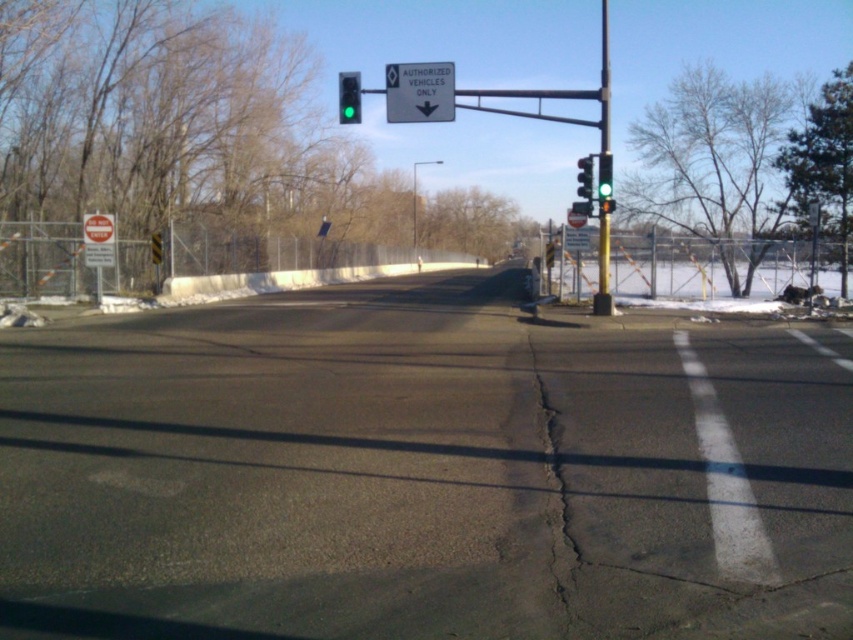
Is green glass traffic light at upper right wider than green glass traffic light at right?

In fact, green glass traffic light at upper right might be narrower than green glass traffic light at right.

Who is shorter, green glass traffic light at upper right or green glass traffic light at right?

Standing shorter between the two is green glass traffic light at upper right.

This screenshot has height=640, width=853. What do you see at coordinates (604, 177) in the screenshot? I see `green glass traffic light at upper right` at bounding box center [604, 177].

Locate an element on the screen. green glass traffic light at upper right is located at coordinates (x=604, y=177).

Looking at this image, who is shorter, metallic pole at right or green glass traffic light at upper center?

green glass traffic light at upper center is shorter.

Does metallic pole at right come in front of green glass traffic light at upper center?

No, metallic pole at right is further to the viewer.

Is point (607, 84) behind point (344, 115)?

That is True.

Locate an element on the screen. This screenshot has width=853, height=640. metallic pole at right is located at coordinates (604, 104).

Which is more to the left, white plastic sign at upper center or green glass traffic light at upper right?

white plastic sign at upper center

Is white plastic sign at upper center bigger than green glass traffic light at upper right?

Correct, white plastic sign at upper center is larger in size than green glass traffic light at upper right.

Identify the location of white plastic sign at upper center. (419, 92).